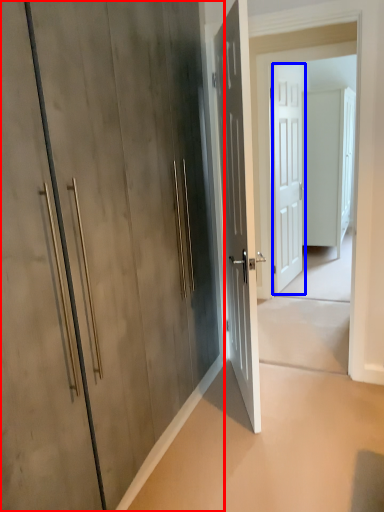
Question: Which object appears farthest to the camera in this image, door (highlighted by a red box) or door (highlighted by a blue box)?

Choices:
 (A) door
 (B) door

Answer: (B)